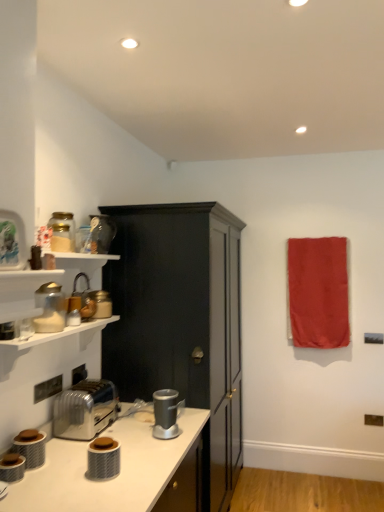
Question: Is matte black cabinet at center spatially inside matte glass jar at upper left, the sixth appliance positioned from the front, or outside of it?

Choices:
 (A) inside
 (B) outside

Answer: (B)

Question: In terms of width, does matte black cabinet at center look wider or thinner when compared to matte glass jar at upper left, acting as the 7th appliance starting from the bottom?

Choices:
 (A) wide
 (B) thin

Answer: (A)

Question: Which object is the closest to the metallic silver kettle at left, marked as the fifth appliance in a front-to-back arrangement?

Choices:
 (A) matte black canister at lower center, placed as the third appliance when sorted from bottom to top
 (B) metallic silver toaster at lower left, which is the seventh appliance in back-to-front order
 (C) red fabric towel at upper right
 (D) matte black cabinet at center
 (E) satin silver coffee machine at lower center

Answer: (E)

Question: Based on their relative distances, which object is farther from the metallic silver kettle at left, marked as the fifth appliance in a front-to-back arrangement?

Choices:
 (A) matte glass jar at upper left, the fourth appliance from the top
 (B) metallic silver toaster at lower left, the 1th appliance ordered from the bottom
 (C) matte white blender at left, the 4th appliance when ordered from front to back
 (D) silver metallic toaster at lower left
 (E) red fabric towel at upper right

Answer: (E)